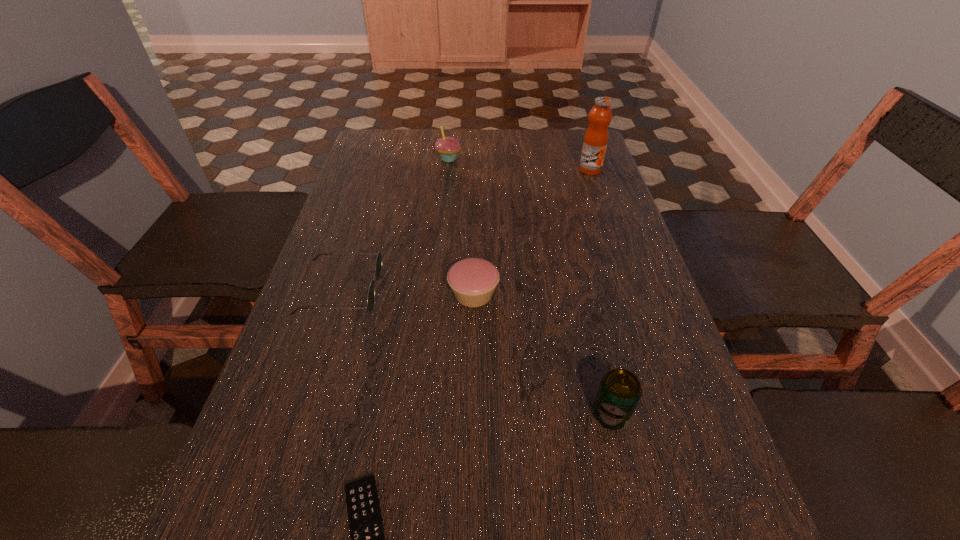
Locate an element on the screen. The image size is (960, 540). object that is at the far right corner is located at coordinates (595, 142).

Locate an element on the screen. The image size is (960, 540). free space at the left edge is located at coordinates tap(341, 250).

In the image, there is a desktop. At what (x,y) coordinates should I click in order to perform the action: click on vacant space at the right edge. Please return your answer as a coordinate pair (x, y). Looking at the image, I should click on (566, 197).

Locate an element on the screen. The width and height of the screenshot is (960, 540). empty location between the tallest object and the third tallest object is located at coordinates (601, 292).

The image size is (960, 540). Find the location of `unoccupied area between the taller cupcake and the shorter cupcake`. unoccupied area between the taller cupcake and the shorter cupcake is located at coordinates (461, 226).

You are a GUI agent. You are given a task and a screenshot of the screen. Output one action in this format:
    pyautogui.click(x=<x>, y=<y>)
    Task: Click on the free point between the leftmost object and the second object from right to left
    Image resolution: width=960 pixels, height=540 pixels.
    Given the screenshot: What is the action you would take?
    pyautogui.click(x=476, y=353)

This screenshot has width=960, height=540. I want to click on unoccupied position between the fifth shortest object and the third shortest object, so click(x=461, y=226).

The width and height of the screenshot is (960, 540). In order to click on free point between the fruit juice and the sunglasses in this screenshot , I will do `click(466, 231)`.

Choose which object is the fifth nearest neighbor to the tallest object. Please provide its 2D coordinates. Your answer should be formatted as a tuple, i.e. [(x, y)], where the tuple contains the x and y coordinates of a point satisfying the conditions above.

[(367, 536)]

Identify which object is the second closest to the tallest object. Please provide its 2D coordinates. Your answer should be formatted as a tuple, i.e. [(x, y)], where the tuple contains the x and y coordinates of a point satisfying the conditions above.

[(473, 280)]